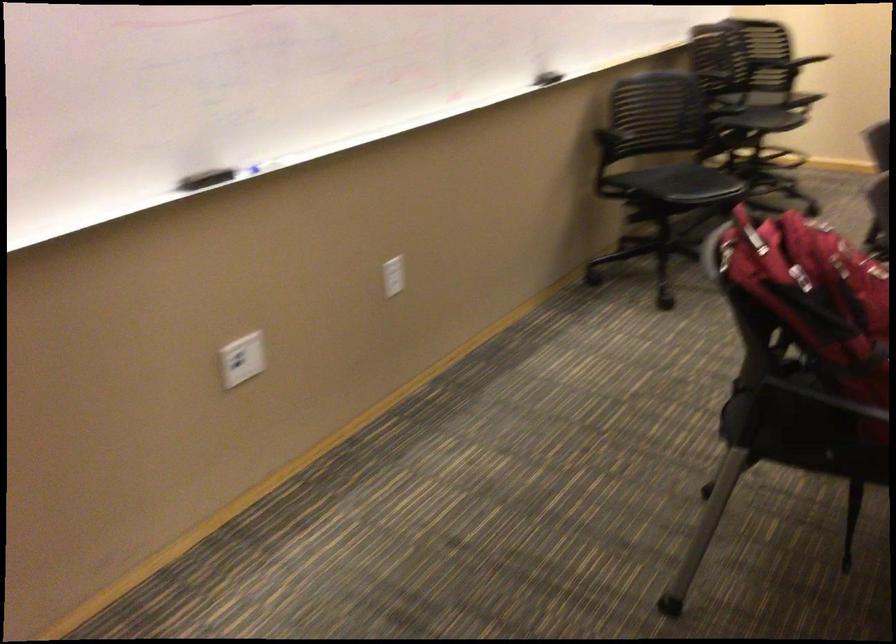
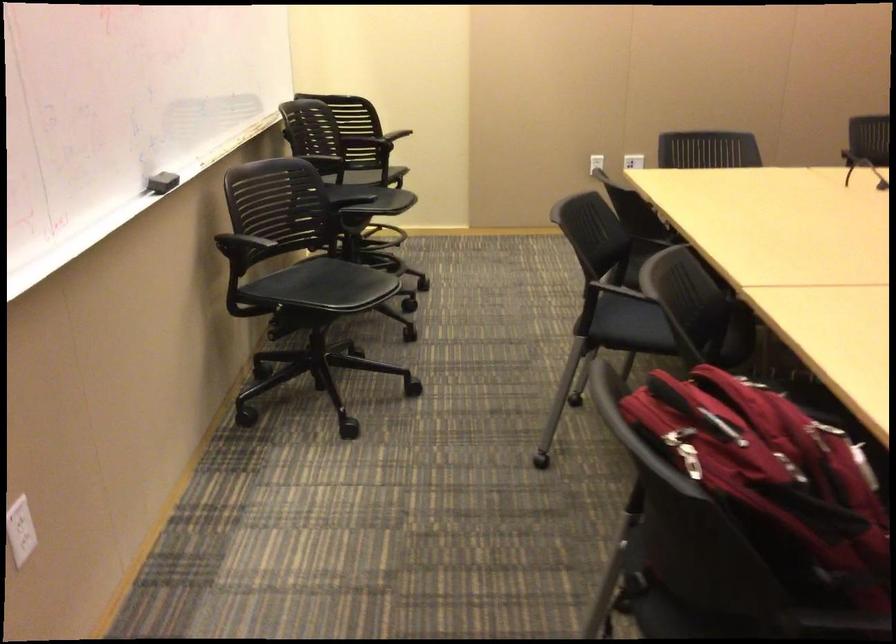
Where in the second image is the point corresponding to (x=795, y=278) from the first image?

(773, 480)